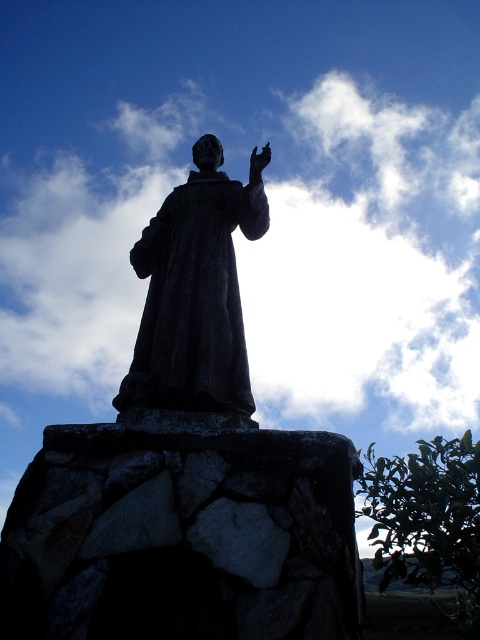
Question: Which point is closer to the camera?

Choices:
 (A) (259, 154)
 (B) (361, 276)
 (C) (351, 554)

Answer: (C)

Question: Can you confirm if white fluffy cloud at upper center is positioned to the right of matte black hand at upper center?

Choices:
 (A) yes
 (B) no

Answer: (A)

Question: Based on their relative distances, which object is nearer to the rough stone pedestal at center?

Choices:
 (A) matte black hand at upper center
 (B) white fluffy cloud at upper center
 (C) matte stone statue at upper center
 (D) black matte robe at center

Answer: (D)

Question: Which point is closer to the camera?

Choices:
 (A) black matte robe at center
 (B) matte stone statue at upper center
 (C) rough stone pedestal at center

Answer: (C)

Question: Is white fluffy cloud at upper center smaller than matte black hand at upper center?

Choices:
 (A) yes
 (B) no

Answer: (B)

Question: Is matte stone statue at upper center wider than matte black hand at upper center?

Choices:
 (A) no
 (B) yes

Answer: (B)